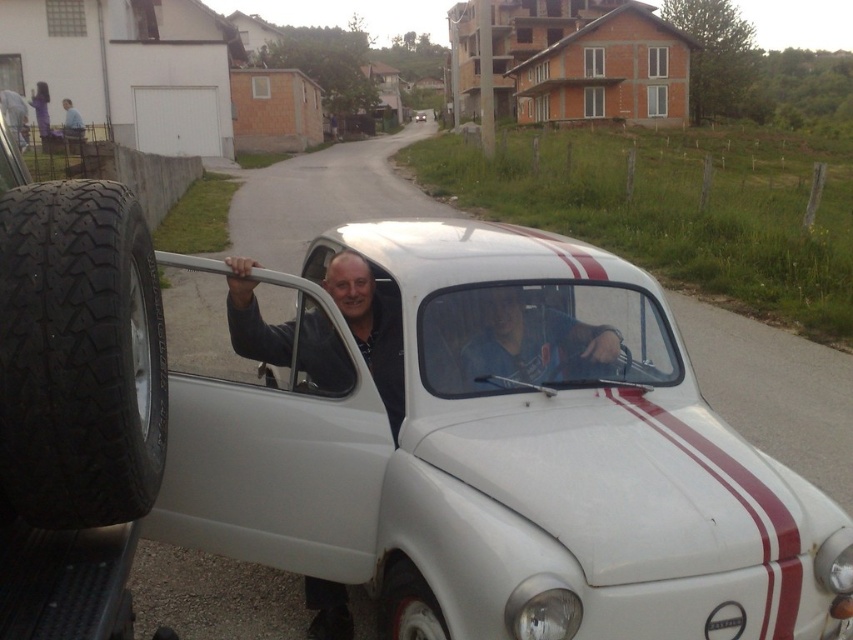
Is point (413, 620) less distant than point (416, 115)?

Yes.

Is point (424, 630) more distant than point (415, 116)?

No, it is in front of (415, 116).

You are a GUI agent. You are given a task and a screenshot of the screen. Output one action in this format:
    pyautogui.click(x=<x>, y=<y>)
    Task: Click on the white rubber tire at lower center
    The width and height of the screenshot is (853, 640).
    Given the screenshot: What is the action you would take?
    pyautogui.click(x=407, y=604)

Describe the element at coordinates (79, 355) in the screenshot. I see `black rubber tire at left` at that location.

Identify the location of black rubber tire at left. This screenshot has height=640, width=853. (79, 355).

Where is `black rubber tire at left`? black rubber tire at left is located at coordinates [x=79, y=355].

Where is `black rubber tire at left`? The image size is (853, 640). black rubber tire at left is located at coordinates (79, 355).

Can you confirm if white rubber tire at lower center is taller than purple fabric dress at upper left?

Incorrect, white rubber tire at lower center's height is not larger of purple fabric dress at upper left's.

Is point (421, 598) more distant than point (32, 99)?

No, (421, 598) is in front of (32, 99).

The height and width of the screenshot is (640, 853). Find the location of `white rubber tire at lower center`. white rubber tire at lower center is located at coordinates (407, 604).